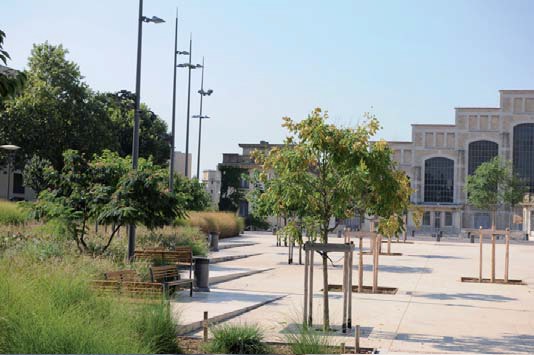
This screenshot has width=534, height=355. What are the coordinates of `lights` in the screenshot? It's located at (156, 20), (183, 48), (183, 66), (205, 93).